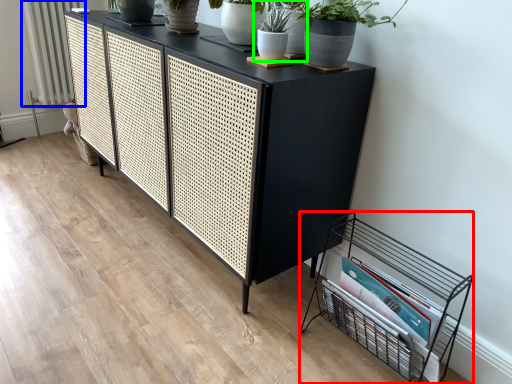
Question: Which object is positioned closest to crate (highlighted by a red box)? Select from radiator (highlighted by a blue box) and houseplant (highlighted by a green box).

Choices:
 (A) radiator
 (B) houseplant

Answer: (B)